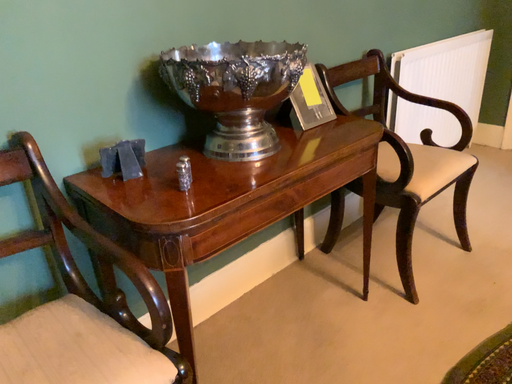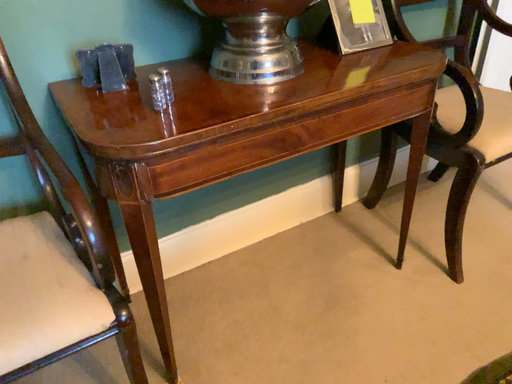
Question: Which way did the camera rotate in the video?

Choices:
 (A) rotated right
 (B) rotated left

Answer: (B)